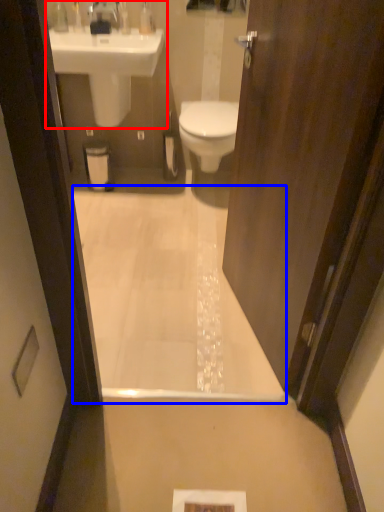
Question: Among these objects, which one is nearest to the camera, sink (highlighted by a red box) or bath (highlighted by a blue box)?

Choices:
 (A) sink
 (B) bath

Answer: (B)